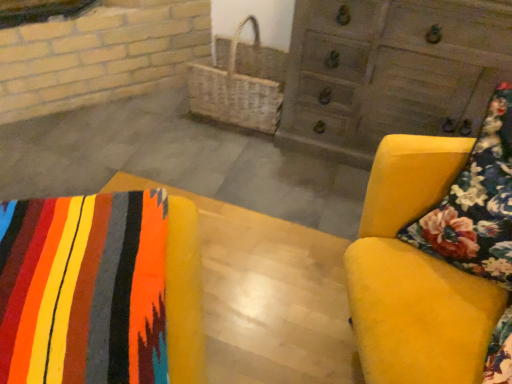
Question: Can you confirm if wooden chest of drawers at upper right is bigger than velvet yellow armchair at right, placed as the 1th furniture when sorted from right to left?

Choices:
 (A) no
 (B) yes

Answer: (A)

Question: Is wooden chest of drawers at upper right positioned in front of velvet yellow armchair at right, placed as the 1th furniture when sorted from right to left?

Choices:
 (A) no
 (B) yes

Answer: (A)

Question: Is velvet yellow armchair at right, placed as the 2th furniture when sorted from left to right, completely or partially inside wooden chest of drawers at upper right?

Choices:
 (A) no
 (B) yes

Answer: (A)

Question: Would you say wooden chest of drawers at upper right is outside velvet yellow armchair at right, placed as the 2th furniture when sorted from left to right?

Choices:
 (A) no
 (B) yes

Answer: (B)

Question: Is wooden chest of drawers at upper right shorter than velvet yellow armchair at right, placed as the 1th furniture when sorted from right to left?

Choices:
 (A) yes
 (B) no

Answer: (A)

Question: Relative to floral fabric cushion at right, is textured wool blanket at lower left, the 2th furniture from the right, in front or behind?

Choices:
 (A) front
 (B) behind

Answer: (A)

Question: Does point (13, 284) appear closer or farther from the camera than point (442, 246)?

Choices:
 (A) closer
 (B) farther

Answer: (A)

Question: From the image's perspective, is textured wool blanket at lower left, the 2th furniture from the right, located above or below floral fabric cushion at right?

Choices:
 (A) below
 (B) above

Answer: (A)

Question: In terms of width, does textured wool blanket at lower left, the 2th furniture from the right, look wider or thinner when compared to floral fabric cushion at right?

Choices:
 (A) thin
 (B) wide

Answer: (B)

Question: From a real-world perspective, is woven wicker basket at center positioned above or below textured wool blanket at lower left, the 1th furniture viewed from the left?

Choices:
 (A) below
 (B) above

Answer: (A)

Question: Is point (236, 31) closer or farther from the camera than point (188, 380)?

Choices:
 (A) closer
 (B) farther

Answer: (B)

Question: In the image, is woven wicker basket at center on the left side or the right side of textured wool blanket at lower left, the 1th furniture viewed from the left?

Choices:
 (A) left
 (B) right

Answer: (B)

Question: Is woven wicker basket at center situated inside textured wool blanket at lower left, the 2th furniture from the right, or outside?

Choices:
 (A) inside
 (B) outside

Answer: (B)

Question: From a real-world perspective, is textured wool blanket at lower left, the 2th furniture from the right, physically located above or below wooden chest of drawers at upper right?

Choices:
 (A) above
 (B) below

Answer: (A)

Question: Considering the relative positions of textured wool blanket at lower left, the 2th furniture from the right, and wooden chest of drawers at upper right in the image provided, is textured wool blanket at lower left, the 2th furniture from the right, to the left or to the right of wooden chest of drawers at upper right?

Choices:
 (A) left
 (B) right

Answer: (A)